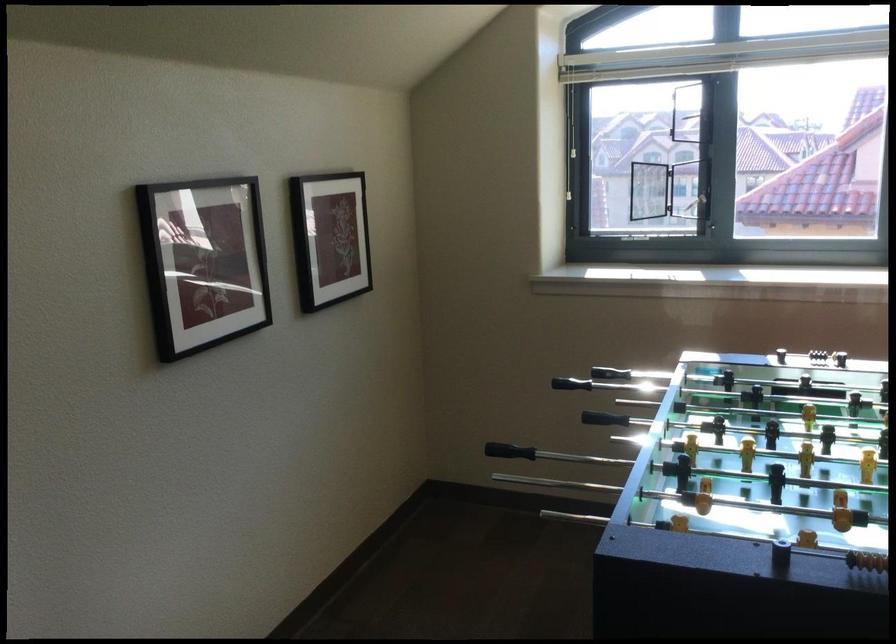
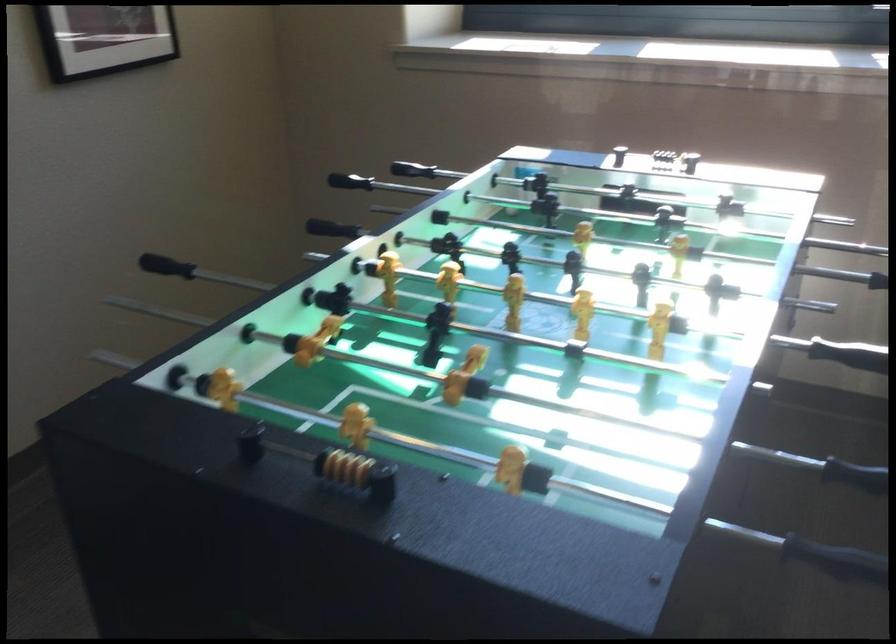
The images are taken continuously from a first-person perspective. In which direction are you moving?

The cameraman walked toward right, forward.